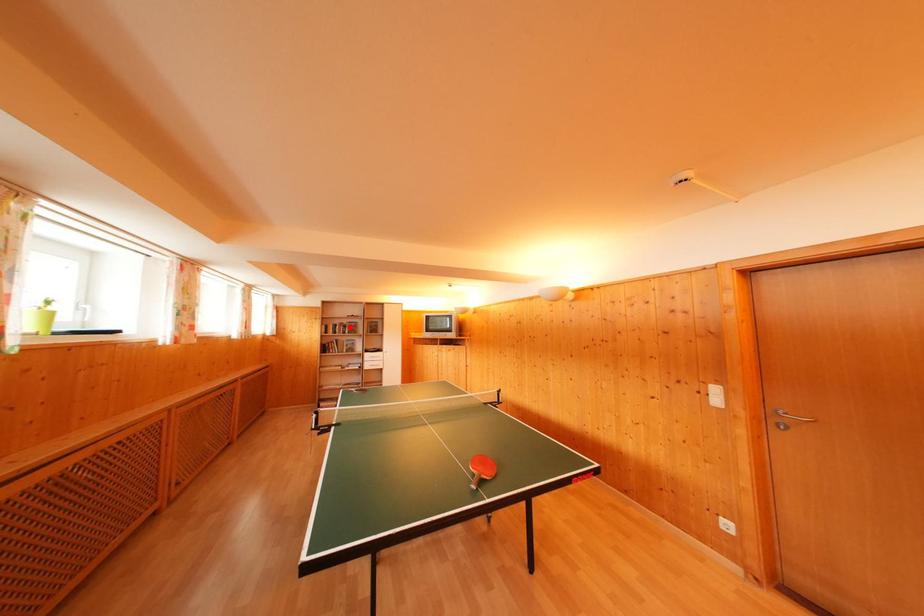
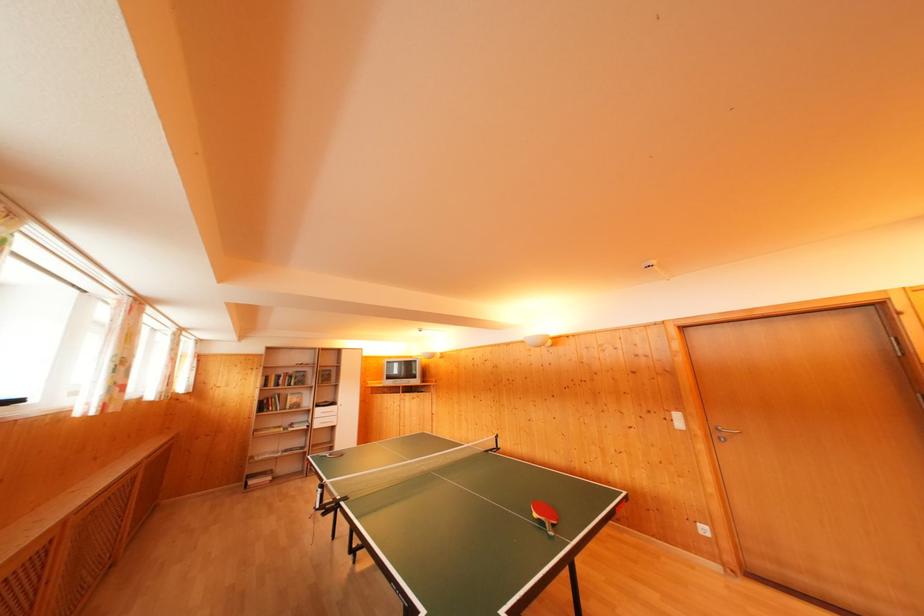
Where in the second image is the point corresponding to the highlighted location from the first image?

(296, 376)